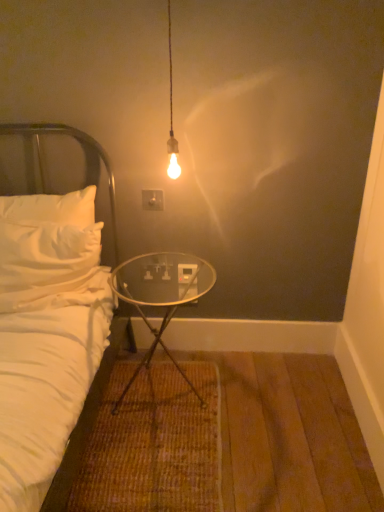
Question: Is white plastic electric outlet at center outside of transparent glass table at center?

Choices:
 (A) yes
 (B) no

Answer: (A)

Question: Are white plastic electric outlet at center and transparent glass table at center far apart?

Choices:
 (A) no
 (B) yes

Answer: (A)

Question: Considering the relative sizes of white plastic electric outlet at center and transparent glass table at center in the image provided, is white plastic electric outlet at center smaller than transparent glass table at center?

Choices:
 (A) yes
 (B) no

Answer: (A)

Question: Is white plastic electric outlet at center taller than transparent glass table at center?

Choices:
 (A) yes
 (B) no

Answer: (B)

Question: Can you confirm if white plastic electric outlet at center is shorter than transparent glass table at center?

Choices:
 (A) no
 (B) yes

Answer: (B)

Question: Can you confirm if white plastic electric outlet at center is bigger than transparent glass table at center?

Choices:
 (A) no
 (B) yes

Answer: (A)

Question: Is the depth of white plastic electric outlet at center less than that of white fabric headboard at left?

Choices:
 (A) no
 (B) yes

Answer: (A)

Question: Is white plastic electric outlet at center facing towards white fabric headboard at left?

Choices:
 (A) no
 (B) yes

Answer: (A)

Question: Is white plastic electric outlet at center outside white fabric headboard at left?

Choices:
 (A) yes
 (B) no

Answer: (A)

Question: Would you consider white plastic electric outlet at center to be distant from white fabric headboard at left?

Choices:
 (A) yes
 (B) no

Answer: (B)

Question: From a real-world perspective, is white plastic electric outlet at center located higher than white fabric headboard at left?

Choices:
 (A) yes
 (B) no

Answer: (A)

Question: Does white plastic electric outlet at center have a lesser width compared to white fabric headboard at left?

Choices:
 (A) yes
 (B) no

Answer: (A)

Question: Does white fabric headboard at left have a greater height compared to white plastic electric outlet at center?

Choices:
 (A) yes
 (B) no

Answer: (A)